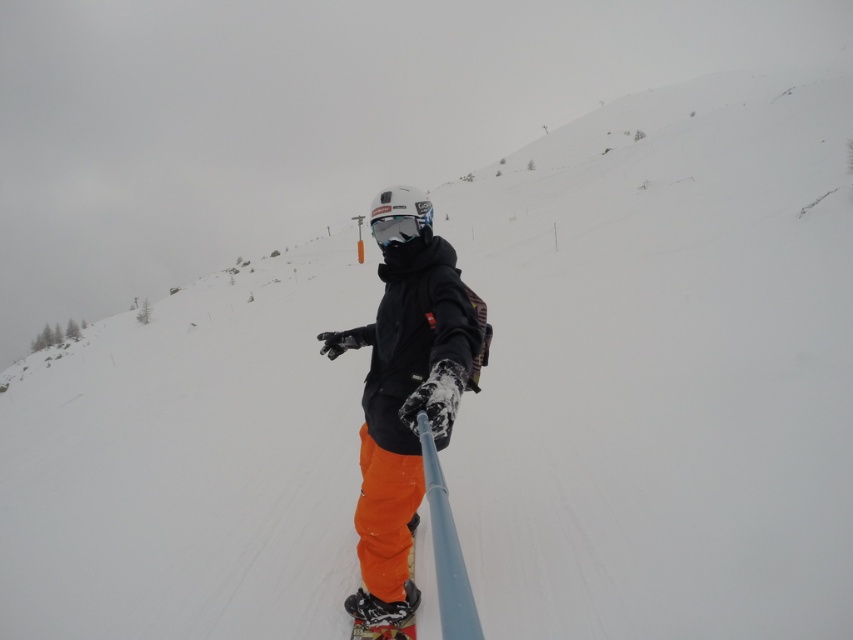
You are a photographer trying to capture the snowboarder. The orange snow pants at center and the orange matte snowboard at lower center are both in your view. Which object is wider in the image?

The orange snow pants at center might be wider than orange matte snowboard at lower center according to the description.

You are a photographer trying to capture the snowboarder using a selfie stick. You need to determine which of the two points, point (332, 337) or point (418, 220), is closer to the camera to ensure proper focus. Which point should you focus on?

You should focus on point (332, 337) because it is closer to the camera than point (418, 220).